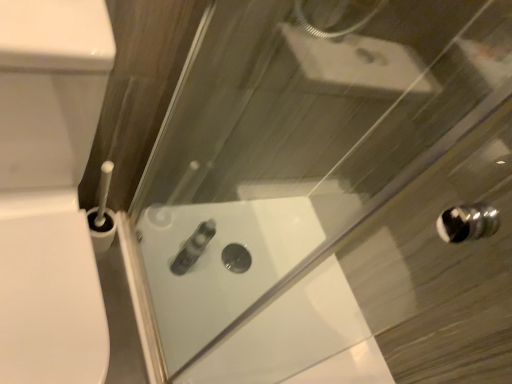
Question: Is white glossy bath at center to the left of white glossy toilet at left from the viewer's perspective?

Choices:
 (A) yes
 (B) no

Answer: (B)

Question: Could you tell me if white glossy bath at center is facing white glossy toilet at left?

Choices:
 (A) yes
 (B) no

Answer: (B)

Question: From the image's perspective, is white glossy bath at center over white glossy toilet at left?

Choices:
 (A) no
 (B) yes

Answer: (A)

Question: Is white glossy toilet at left at the back of white glossy bath at center?

Choices:
 (A) no
 (B) yes

Answer: (A)

Question: From the image's perspective, is white glossy bath at center located beneath white glossy toilet at left?

Choices:
 (A) yes
 (B) no

Answer: (A)

Question: From a real-world perspective, is white glossy bath at center located higher than white glossy toilet at left?

Choices:
 (A) yes
 (B) no

Answer: (B)

Question: Can satin silver tube at center be found inside white glossy toilet at left?

Choices:
 (A) no
 (B) yes

Answer: (A)

Question: From the image's perspective, is white glossy toilet at left beneath satin silver tube at center?

Choices:
 (A) yes
 (B) no

Answer: (B)

Question: Would you consider white glossy toilet at left to be distant from satin silver tube at center?

Choices:
 (A) no
 (B) yes

Answer: (A)

Question: Can you confirm if white glossy toilet at left is thinner than satin silver tube at center?

Choices:
 (A) no
 (B) yes

Answer: (A)

Question: From a real-world perspective, is white glossy toilet at left located beneath satin silver tube at center?

Choices:
 (A) no
 (B) yes

Answer: (A)

Question: From a real-world perspective, is white glossy toilet at left physically above satin silver tube at center?

Choices:
 (A) no
 (B) yes

Answer: (B)

Question: Does satin silver tube at center have a larger size compared to white glossy toilet at left?

Choices:
 (A) no
 (B) yes

Answer: (A)